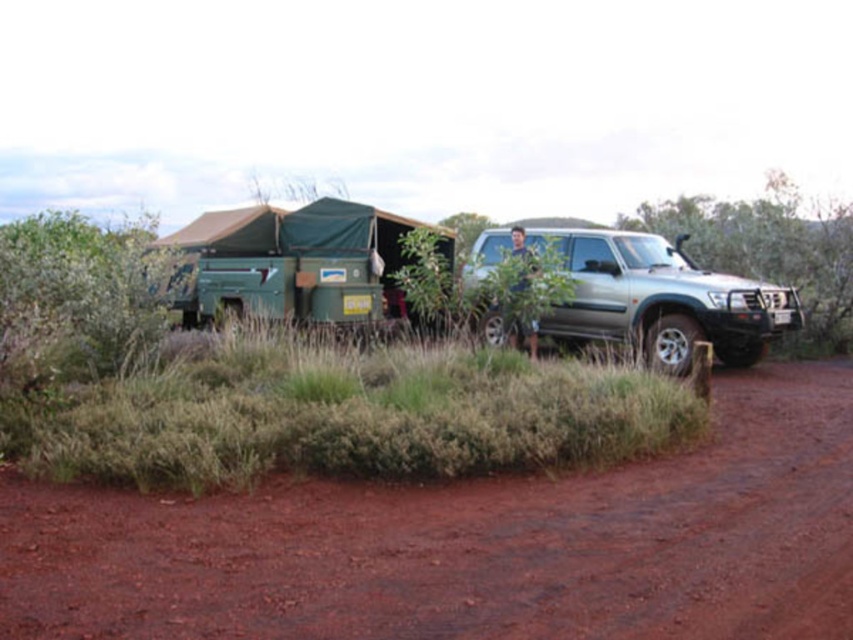
Question: Which object is positioned farthest from the silver metallic jeep at right?

Choices:
 (A) red clay dirt track at lower center
 (B) green leafy bush at right

Answer: (A)

Question: Which of the following is the closest to the observer?

Choices:
 (A) silver metallic jeep at right
 (B) red clay dirt track at lower center
 (C) green leafy bush at right

Answer: (B)

Question: Among these points, which one is farthest from the camera?

Choices:
 (A) (767, 502)
 (B) (585, 321)
 (C) (660, 224)

Answer: (C)

Question: Can you confirm if red clay dirt track at lower center is thinner than silver metallic jeep at right?

Choices:
 (A) no
 (B) yes

Answer: (A)

Question: Does silver metallic jeep at right have a smaller size compared to green leafy bush at right?

Choices:
 (A) no
 (B) yes

Answer: (B)

Question: Does red clay dirt track at lower center appear on the left side of silver metallic jeep at right?

Choices:
 (A) yes
 (B) no

Answer: (A)